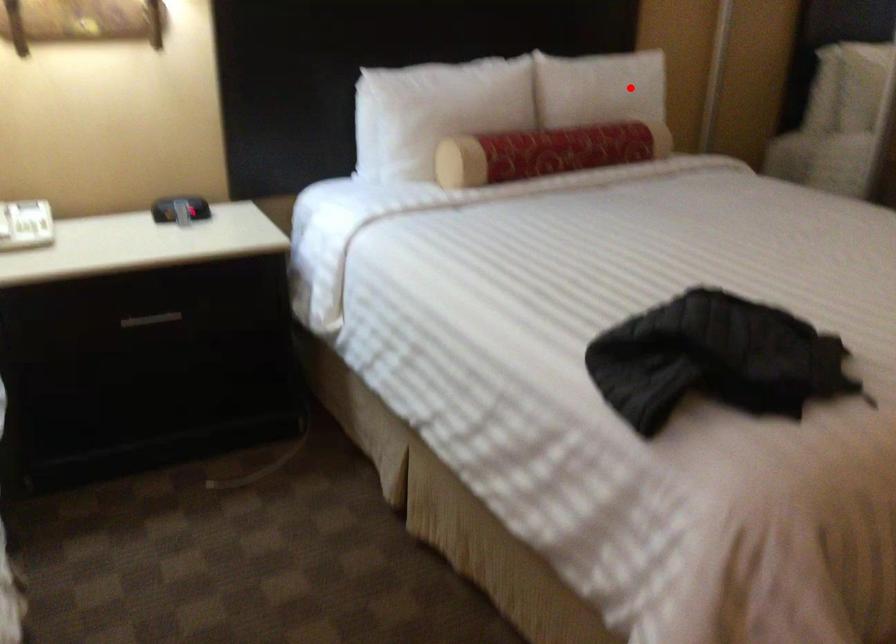
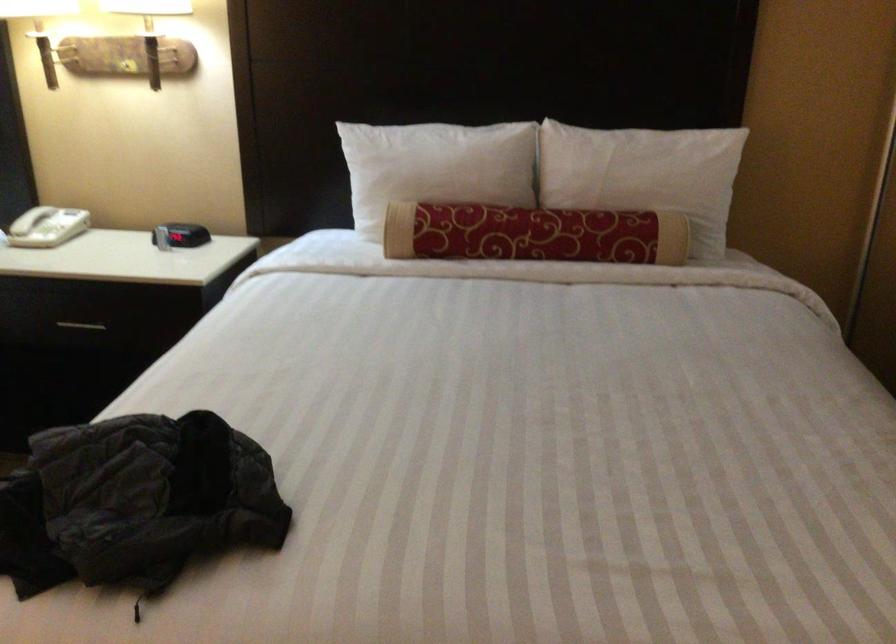
Where in the second image is the point corresponding to the highlighted location from the first image?

(643, 174)